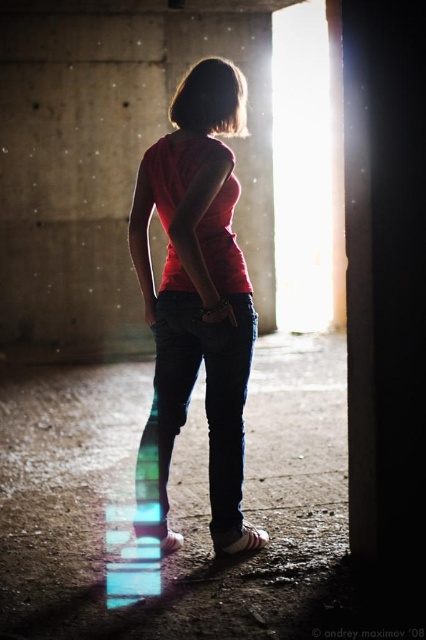
Question: Among these points, which one is farthest from the camera?

Choices:
 (A) (221, 216)
 (B) (158, 529)

Answer: (B)

Question: Where is matte red t-shirt at center located in relation to black denim jeans at center in the image?

Choices:
 (A) below
 (B) above

Answer: (B)

Question: Can you confirm if matte red t-shirt at center is positioned to the right of black denim jeans at center?

Choices:
 (A) no
 (B) yes

Answer: (B)

Question: Can you confirm if matte red t-shirt at center is thinner than black denim jeans at center?

Choices:
 (A) no
 (B) yes

Answer: (A)